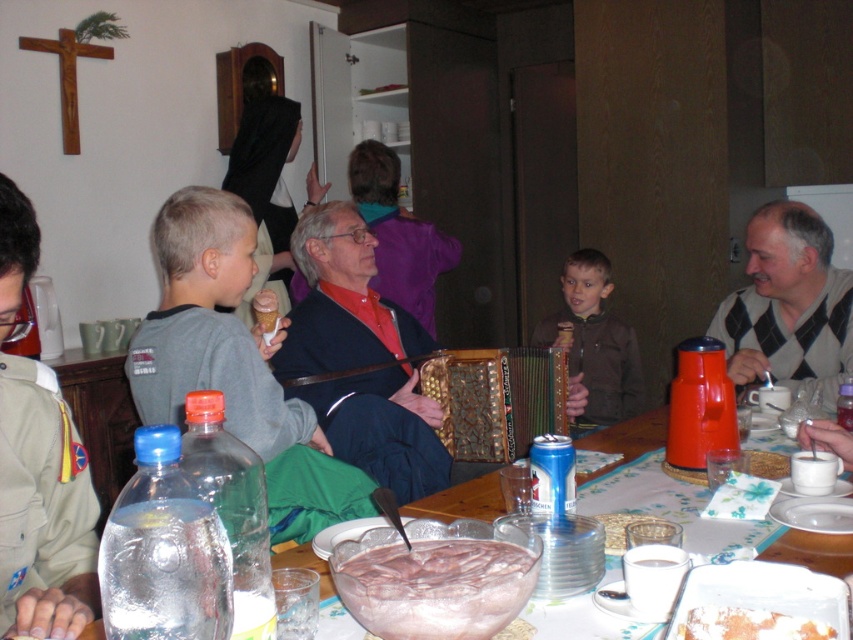
Question: Does gray sweater at right have a greater width compared to white crumbly cake at table center?

Choices:
 (A) yes
 (B) no

Answer: (A)

Question: In this image, where is gray sweater at right located relative to white crumbly cake at table center?

Choices:
 (A) above
 (B) below

Answer: (A)

Question: Which point is closer to the camera?

Choices:
 (A) pink frosted cake at center
 (B) white crumbly cake at table center

Answer: (B)

Question: Which object is closer to the camera taking this photo?

Choices:
 (A) reddish-brown leather jacket at center
 (B) khaki uniform at lower left

Answer: (B)

Question: Among these points, which one is farthest from the camera?

Choices:
 (A) (820, 352)
 (B) (30, 579)
 (C) (318, 563)
 (D) (717, 608)

Answer: (A)

Question: Is reddish-brown leather jacket at center to the right of translucent plastic table at lower center from the viewer's perspective?

Choices:
 (A) yes
 (B) no

Answer: (B)